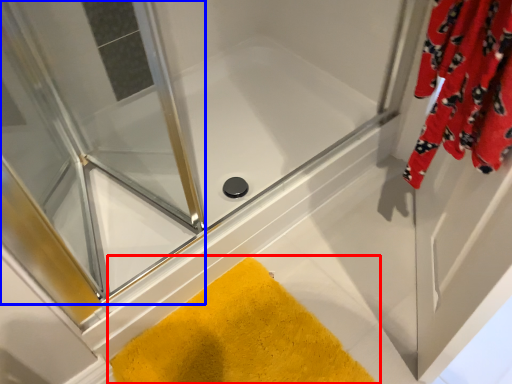
Question: Which point is further to the camera, bath mat (highlighted by a red box) or screen door (highlighted by a blue box)?

Choices:
 (A) bath mat
 (B) screen door

Answer: (A)